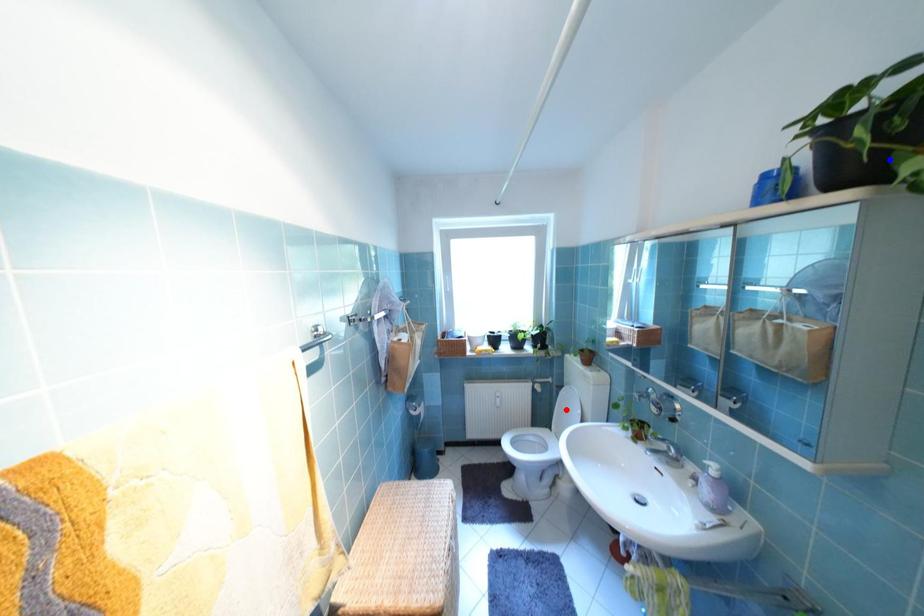
Question: In the image, two points are highlighted. Which point is nearer to the camera? Reply with the corresponding letter.

Choices:
 (A) blue point
 (B) red point

Answer: (A)